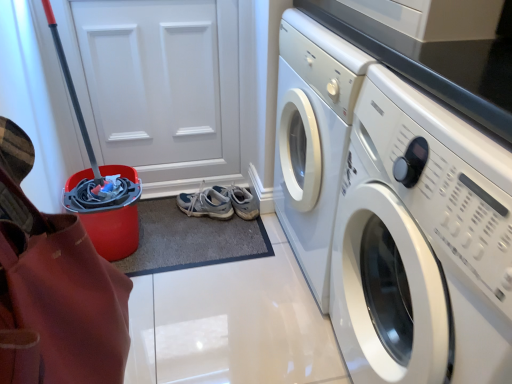
Measure the distance between point (x=27, y=289) and camera.

Point (x=27, y=289) and camera are 48.60 centimeters apart from each other.

The height and width of the screenshot is (384, 512). What do you see at coordinates (207, 203) in the screenshot?
I see `light gray fabric running shoe at center` at bounding box center [207, 203].

Locate an element on the screen. This screenshot has width=512, height=384. white glossy washing machine at right is located at coordinates (421, 243).

From a real-world perspective, is white glossy washing machine at right over white matte door at upper left?

No.

Are white glossy washing machine at right and white matte door at upper left located far from each other?

Yes.

From the image's perspective, does white glossy washing machine at right appear higher than white matte door at upper left?

No.

Is white matte door at upper left touching light gray fabric running shoe at center?

No, white matte door at upper left is not beside light gray fabric running shoe at center.

Considering the sizes of objects white matte door at upper left and light gray fabric running shoe at center in the image provided, who is smaller, white matte door at upper left or light gray fabric running shoe at center?

Smaller between the two is light gray fabric running shoe at center.

How different are the orientations of white matte door at upper left and light gray fabric running shoe at center in degrees?

39.5 degrees.

Between red plastic bucket at left and white glossy washing machine at right, which one has more height?

white glossy washing machine at right is taller.

From a real-world perspective, does red plastic bucket at left stand above white glossy washing machine at right?

Yes, from a real-world perspective, red plastic bucket at left is above white glossy washing machine at right.

Does red plastic bucket at left contain white glossy washing machine at right?

No, red plastic bucket at left does not contain white glossy washing machine at right.

Which object is positioned more to the left, red plastic bucket at left or white glossy washing machine at right?

Positioned to the left is red plastic bucket at left.

From a real-world perspective, is white matte door at upper left positioned under white glossy washing machine at right based on gravity?

No, from a real-world perspective, white matte door at upper left is not under white glossy washing machine at right.

Considering the relative positions of white matte door at upper left and white glossy washing machine at right in the image provided, is white matte door at upper left to the left or to the right of white glossy washing machine at right?

white matte door at upper left is positioned on white glossy washing machine at right's left side.

Which of these two, white matte door at upper left or white glossy washing machine at right, stands taller?

white matte door at upper left is taller.

Considering the sizes of white matte door at upper left and white glossy washing machine at right in the image, is white matte door at upper left bigger or smaller than white glossy washing machine at right?

In the image, white matte door at upper left appears to be smaller than white glossy washing machine at right.

Is white glossy washing machine at right positioned in front of light gray fabric running shoe at center?

That is True.

Can you confirm if white glossy washing machine at right is taller than light gray fabric running shoe at center?

Yes.

Considering the relative positions of white glossy washing machine at right and light gray fabric running shoe at center in the image provided, is white glossy washing machine at right to the left of light gray fabric running shoe at center from the viewer's perspective?

Incorrect, white glossy washing machine at right is not on the left side of light gray fabric running shoe at center.

From a real-world perspective, is white glossy washing machine at right above or below light gray fabric running shoe at center?

From a real-world perspective, white glossy washing machine at right is physically above light gray fabric running shoe at center.

Which is more to the right, light gray fabric running shoe at center or red plastic bucket at left?

Positioned to the right is light gray fabric running shoe at center.

From the image's perspective, is light gray fabric running shoe at center above or below red plastic bucket at left?

Based on their image positions, light gray fabric running shoe at center is located above red plastic bucket at left.

Which of these two, light gray fabric running shoe at center or red plastic bucket at left, is smaller?

light gray fabric running shoe at center.

Is light gray fabric running shoe at center turned away from red plastic bucket at left?

No.

Is white matte door at upper left turned away from red plastic bucket at left?

No, white matte door at upper left's orientation is not away from red plastic bucket at left.

Which is behind, white matte door at upper left or red plastic bucket at left?

white matte door at upper left is more distant.

From a real-world perspective, which is physically below, white matte door at upper left or red plastic bucket at left?

white matte door at upper left.

How distant is white matte door at upper left from red plastic bucket at left?

The distance of white matte door at upper left from red plastic bucket at left is 3.86 feet.

You are a GUI agent. You are given a task and a screenshot of the screen. Output one action in this format:
    pyautogui.click(x=<x>, y=<y>)
    Task: Click on the washing machine that is in front of the white matte door at upper left
    The width and height of the screenshot is (512, 384).
    Given the screenshot: What is the action you would take?
    point(421,243)

You are a GUI agent. You are given a task and a screenshot of the screen. Output one action in this format:
    pyautogui.click(x=<x>, y=<y>)
    Task: Click on the door on the left of light gray fabric running shoe at center
    Image resolution: width=512 pixels, height=384 pixels.
    Given the screenshot: What is the action you would take?
    pyautogui.click(x=163, y=85)

Based on the photo, estimate the real-world distances between objects in this image. Which object is further from red plastic bucket at left, light gray fabric running shoe at center or white glossy washing machine at right?

Based on the image, light gray fabric running shoe at center appears to be further to red plastic bucket at left.

From the image, which object appears to be nearer to light gray fabric running shoe at center, white matte door at upper left or white glossy washing machine at right?

white matte door at upper left is closer to light gray fabric running shoe at center.

Estimate the real-world distances between objects in this image. Which object is further from white glossy washing machine at right, light gray fabric running shoe at center or white matte door at upper left?

Among the two, white matte door at upper left is located further to white glossy washing machine at right.

When comparing their distances from white glossy washing machine at right, does red plastic bucket at left or light gray fabric running shoe at center seem closer?

red plastic bucket at left is closer to white glossy washing machine at right.

Considering their positions, is white glossy washing machine at right positioned further to red plastic bucket at left than white matte door at upper left?

white matte door at upper left lies further to red plastic bucket at left than the other object.

Which object lies further to the anchor point light gray fabric running shoe at center, white glossy washing machine at right or white matte door at upper left?

white glossy washing machine at right is positioned further to the anchor light gray fabric running shoe at center.

Considering their positions, is red plastic bucket at left positioned closer to light gray fabric running shoe at center than white matte door at upper left?

Based on the image, white matte door at upper left appears to be nearer to light gray fabric running shoe at center.

When comparing their distances from white matte door at upper left, does light gray fabric running shoe at center or red plastic bucket at left seem further?

Based on the image, red plastic bucket at left appears to be further to white matte door at upper left.

The width and height of the screenshot is (512, 384). I want to click on washing machine between red plastic bucket at left and white matte door at upper left in the front-back direction, so click(x=421, y=243).

This screenshot has width=512, height=384. Identify the location of washing machine between red plastic bucket at left and light gray fabric running shoe at center in the front-back direction. (421, 243).

Locate an element on the screen. door positioned between red plastic bucket at left and light gray fabric running shoe at center from near to far is located at coordinates (163, 85).

You are a GUI agent. You are given a task and a screenshot of the screen. Output one action in this format:
    pyautogui.click(x=<x>, y=<y>)
    Task: Click on the door between white glossy washing machine at right and light gray fabric running shoe at center along the z-axis
    Image resolution: width=512 pixels, height=384 pixels.
    Given the screenshot: What is the action you would take?
    pyautogui.click(x=163, y=85)